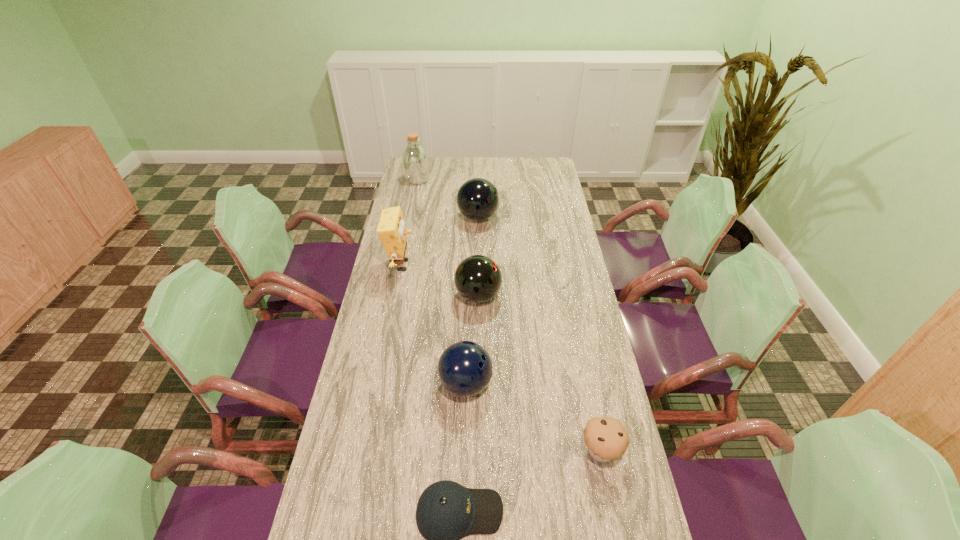
Find the location of a particular element. The image size is (960, 540). vacant area at the right edge of the desktop is located at coordinates (564, 396).

Image resolution: width=960 pixels, height=540 pixels. In the image, there is a desktop. In order to click on free space at the far left corner in this screenshot , I will do `click(433, 162)`.

Image resolution: width=960 pixels, height=540 pixels. I want to click on vacant region between the third nearest object and the second nearest bowling ball, so click(472, 340).

You are a GUI agent. You are given a task and a screenshot of the screen. Output one action in this format:
    pyautogui.click(x=<x>, y=<y>)
    Task: Click on the vacant area that lies between the sixth nearest object and the second nearest object
    
    Given the screenshot: What is the action you would take?
    pyautogui.click(x=540, y=334)

Find the location of `vacant space in between the bottle and the nearest bowling ball`. vacant space in between the bottle and the nearest bowling ball is located at coordinates (442, 282).

You are a GUI agent. You are given a task and a screenshot of the screen. Output one action in this format:
    pyautogui.click(x=<x>, y=<y>)
    Task: Click on the vacant point located between the sixth farthest object and the sponge
    The image size is (960, 540).
    Given the screenshot: What is the action you would take?
    pyautogui.click(x=501, y=358)

The width and height of the screenshot is (960, 540). I want to click on the third closest object to the nearest object, so click(478, 278).

You are a GUI agent. You are given a task and a screenshot of the screen. Output one action in this format:
    pyautogui.click(x=<x>, y=<y>)
    Task: Click on the object that is the third closest one to the sponge
    The height and width of the screenshot is (540, 960).
    Given the screenshot: What is the action you would take?
    pyautogui.click(x=465, y=368)

Where is `the closest bowling ball to the farthest bowling ball`? This screenshot has height=540, width=960. the closest bowling ball to the farthest bowling ball is located at coordinates (478, 278).

Image resolution: width=960 pixels, height=540 pixels. I want to click on the closest bowling ball to the baseball cap, so click(465, 368).